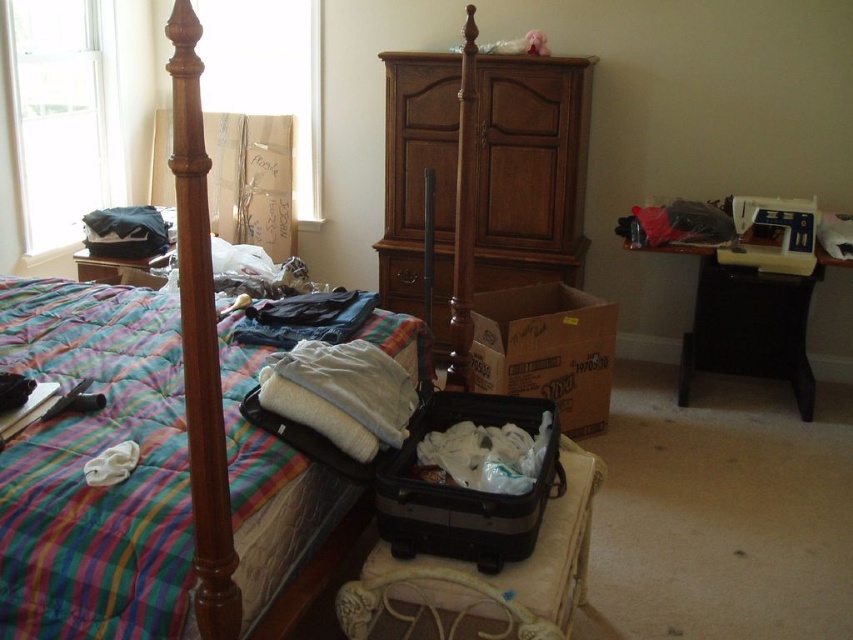
Question: Which point is farther from the camera taking this photo?

Choices:
 (A) (413, 449)
 (B) (514, 445)
 (C) (239, 444)

Answer: (B)

Question: Which point is closer to the camera taking this photo?

Choices:
 (A) (260, 481)
 (B) (392, 257)
 (C) (544, 417)
 (D) (590, 397)

Answer: (A)

Question: Does plaid fabric bed at center have a larger size compared to cardboard box at center?

Choices:
 (A) yes
 (B) no

Answer: (A)

Question: Which point is closer to the camera?

Choices:
 (A) click(480, 460)
 (B) click(180, 81)

Answer: (B)

Question: Can you confirm if plaid fabric bed at center is positioned to the left of wooden cabinet at center?

Choices:
 (A) no
 (B) yes

Answer: (B)

Question: Can you confirm if cardboard box at center is smaller than white soft blanket at center?

Choices:
 (A) no
 (B) yes

Answer: (A)